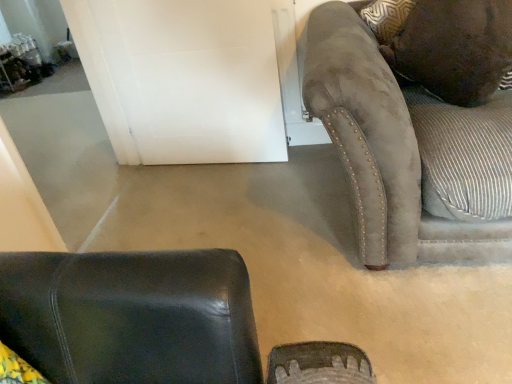
The width and height of the screenshot is (512, 384). I want to click on vacant area situated below white matte door at upper center (from a real-world perspective), so click(x=211, y=167).